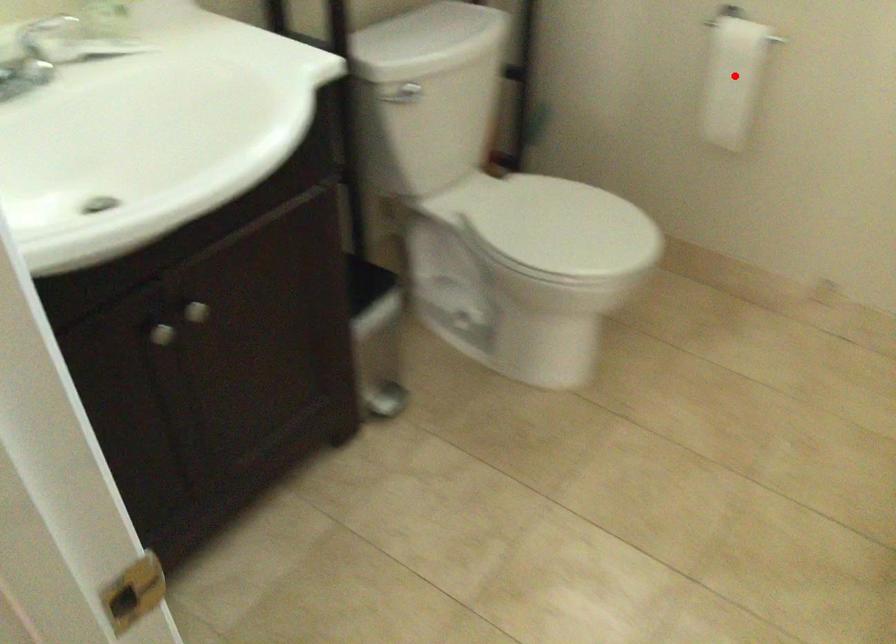
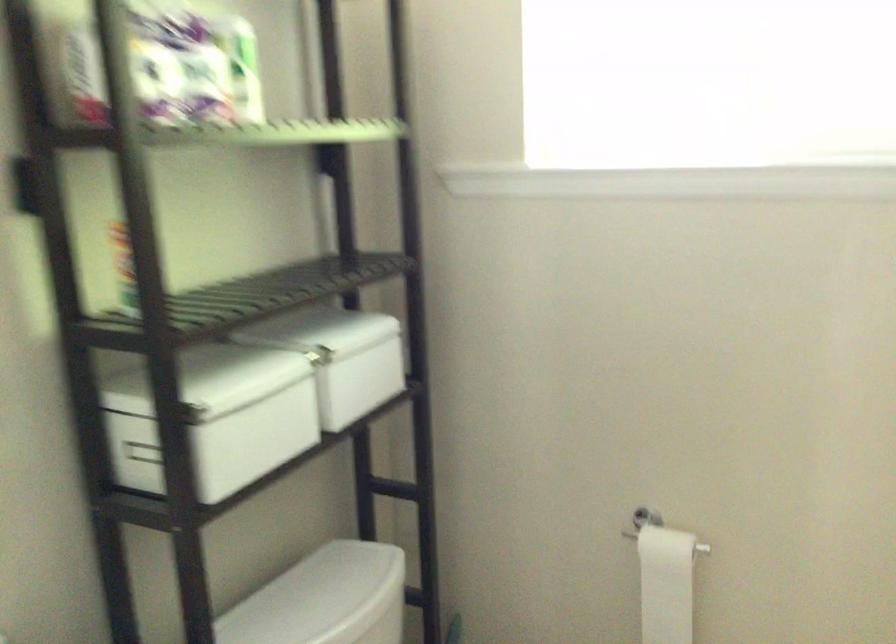
Where in the second image is the point corresponding to the highlighted location from the first image?

(666, 583)